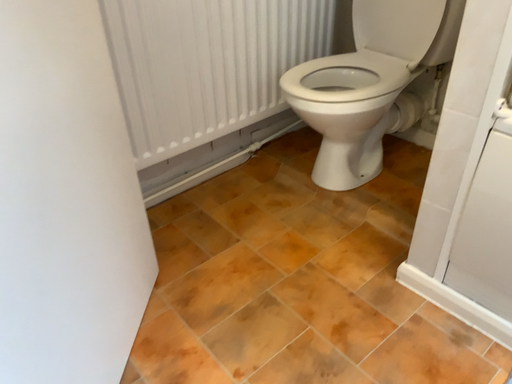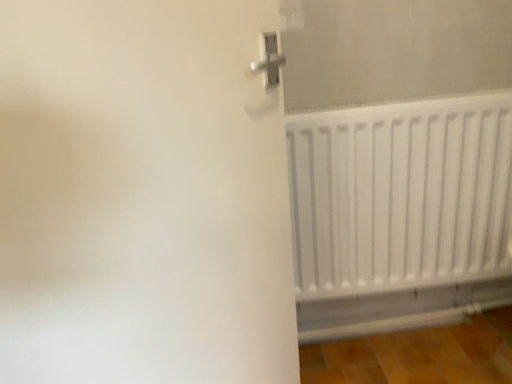
Question: Which way did the camera rotate in the video?

Choices:
 (A) rotated upward
 (B) rotated downward

Answer: (A)